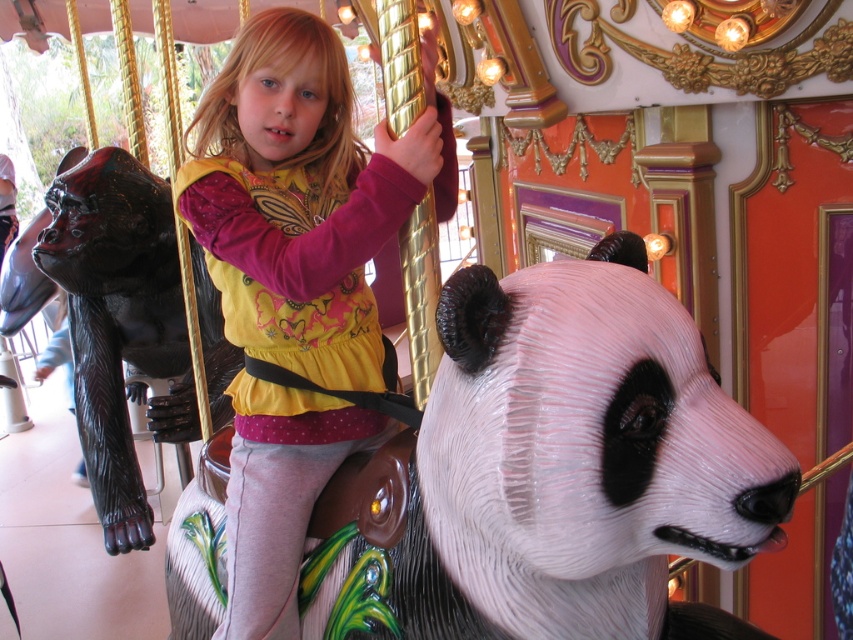
You are a photographer standing at the base of the carousel. You want to take a closeup photo of the white glossy panda head at center without moving the carousel. Can you get close enough to take the photo if your camera has a maximum focus range of 3.5 feet?

The white glossy panda head at center is 3.87 feet away from camera. Since the distance is greater than the camera maximum focus range of 3.5 feet, you cannot take a closeup photo without moving closer.

You are standing at the center of the carousel and want to find the white glossy panda head at center. According to the coordinates given, in which direction should you look to locate it?

The white glossy panda head at center is located at coordinates point (555, 472), so you should look towards the lower right direction from the center to locate it.

You are a photographer trying to capture a clear shot of the white glossy panda head at center and the matte yellow shirt at center. Which object should you focus on first if you want to ensure both are in focus without adjusting your camera settings?

The white glossy panda head at center has a lesser height compared to matte yellow shirt at center, so you should focus on the matte yellow shirt at center first since it is taller and might be further away, ensuring depth of field covers both.